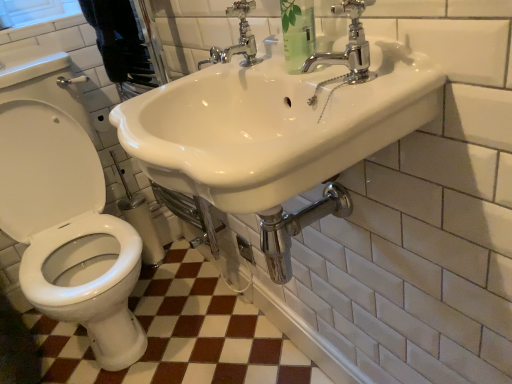
Question: Could you tell me if white glossy sink at upper center is facing clear plastic bottle at upper center?

Choices:
 (A) no
 (B) yes

Answer: (A)

Question: Does white glossy sink at upper center lie in front of clear plastic bottle at upper center?

Choices:
 (A) no
 (B) yes

Answer: (B)

Question: From a real-world perspective, does white glossy sink at upper center sit lower than clear plastic bottle at upper center?

Choices:
 (A) no
 (B) yes

Answer: (B)

Question: Is white glossy sink at upper center placed right next to clear plastic bottle at upper center?

Choices:
 (A) yes
 (B) no

Answer: (B)

Question: Is clear plastic bottle at upper center surrounded by white glossy sink at upper center?

Choices:
 (A) yes
 (B) no

Answer: (B)

Question: Which is correct: white glossy toilet at left is inside white glossy ceramic tile at lower left, or outside of it?

Choices:
 (A) inside
 (B) outside

Answer: (B)

Question: In terms of height, does white glossy toilet at left look taller or shorter compared to white glossy ceramic tile at lower left?

Choices:
 (A) tall
 (B) short

Answer: (A)

Question: Looking at the image, does white glossy toilet at left seem bigger or smaller compared to white glossy ceramic tile at lower left?

Choices:
 (A) big
 (B) small

Answer: (A)

Question: From a real-world perspective, is white glossy toilet at left physically located above or below white glossy ceramic tile at lower left?

Choices:
 (A) below
 (B) above

Answer: (B)

Question: In terms of size, does white glossy toilet at left appear bigger or smaller than chrome/metallic faucet at upper right, which ranks as the 1th tap in right-to-left order?

Choices:
 (A) big
 (B) small

Answer: (A)

Question: Is point (88, 203) positioned closer to the camera than point (364, 1)?

Choices:
 (A) closer
 (B) farther

Answer: (B)

Question: From a real-world perspective, relative to chrome/metallic faucet at upper right, acting as the first tap starting from the front, is white glossy toilet at left vertically above or below?

Choices:
 (A) below
 (B) above

Answer: (A)

Question: Is white glossy toilet at left wider or thinner than chrome/metallic faucet at upper right, which is the 2th tap from left to right?

Choices:
 (A) thin
 (B) wide

Answer: (B)

Question: Looking at their shapes, would you say chrome/metallic faucet at upper center, positioned as the second tap in front-to-back order, is wider or thinner than chrome/metallic faucet at upper right, which ranks as the 1th tap in right-to-left order?

Choices:
 (A) wide
 (B) thin

Answer: (B)

Question: Is point coord(225,51) positioned closer to the camera than point coord(373,74)?

Choices:
 (A) closer
 (B) farther

Answer: (B)